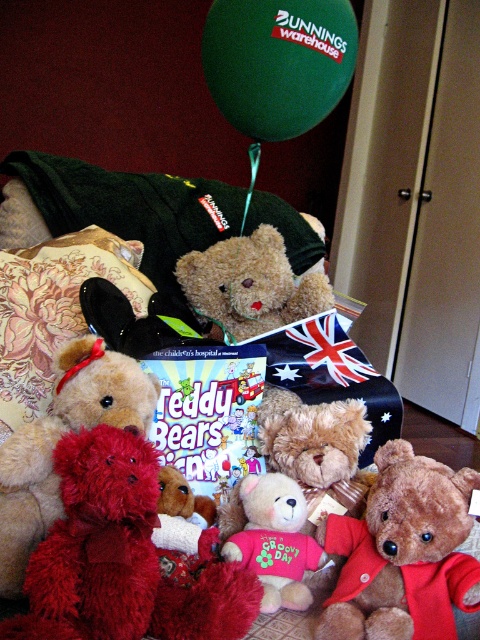
Is velvety brown teddy bear at center thinner than fluffy pink teddy bear at center?

No.

The height and width of the screenshot is (640, 480). What do you see at coordinates (403, 552) in the screenshot?
I see `velvety brown teddy bear at center` at bounding box center [403, 552].

Is point (408, 531) farther from viewer compared to point (267, 608)?

No, it is in front of (267, 608).

At what (x,y) coordinates should I click in order to perform the action: click on velvety brown teddy bear at center. Please return your answer as a coordinate pair (x, y). This screenshot has height=640, width=480. Looking at the image, I should click on (403, 552).

Is green matte balloon at upper center to the left of fluffy brown teddy bear at center from the viewer's perspective?

Yes, green matte balloon at upper center is to the left of fluffy brown teddy bear at center.

Locate an element on the screen. Image resolution: width=480 pixels, height=640 pixels. green matte balloon at upper center is located at coordinates (277, 61).

Can you confirm if velvet floral pillow at center is positioned to the right of fluffy brown teddy bear at center?

In fact, velvet floral pillow at center is to the left of fluffy brown teddy bear at center.

Is velvet floral pillow at center taller than fluffy brown teddy bear at center?

Correct, velvet floral pillow at center is much taller as fluffy brown teddy bear at center.

The height and width of the screenshot is (640, 480). Identify the location of velvet floral pillow at center. (54, 310).